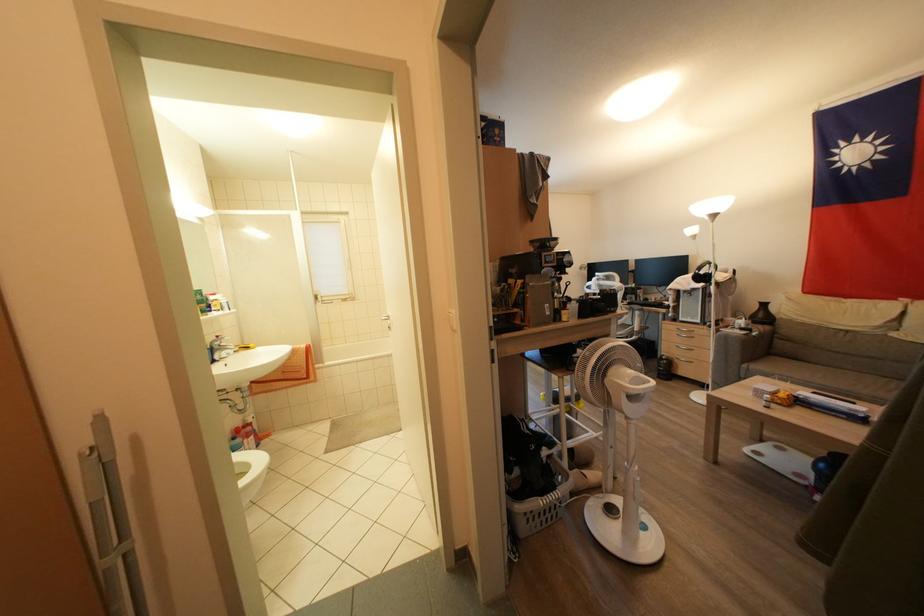
Where would you wear the black headphones? Please return your answer as a coordinate pair (x, y).

(703, 273)